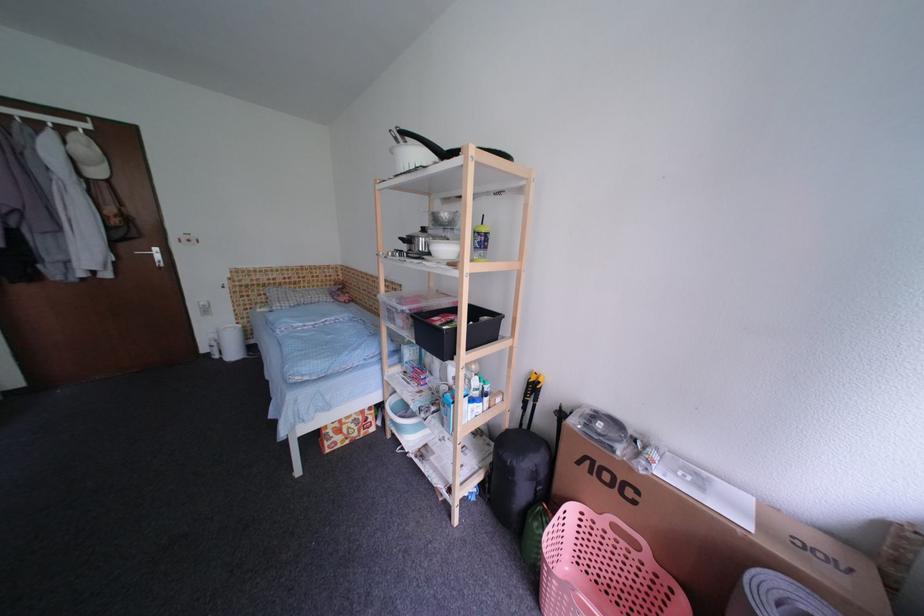
Find where to lift the plastic cup with lid. Please return your answer as a coordinate pair (x, y).

(403, 418)